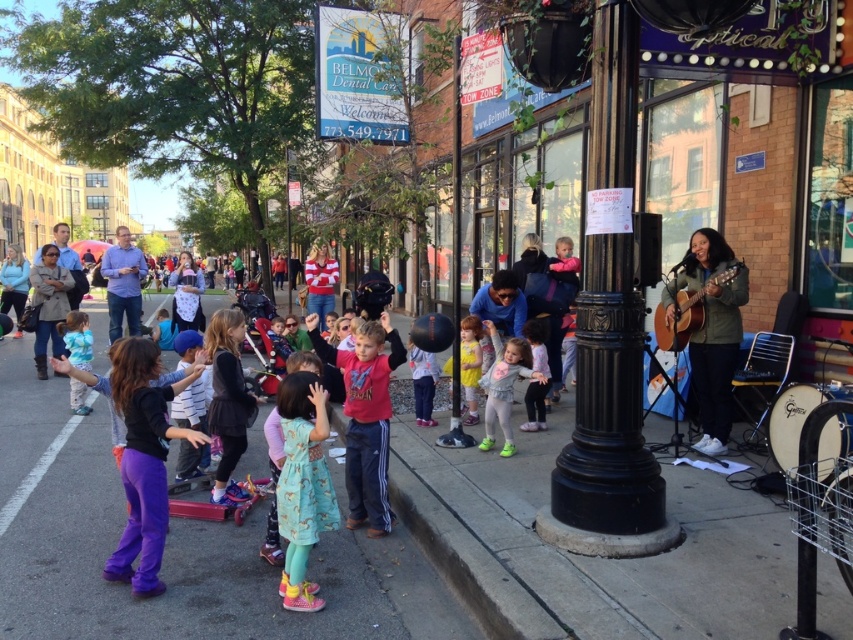
Who is more distant from viewer, (521,358) or (172,282)?

Positioned behind is point (172,282).

Who is higher up, pastel pink dress at center or matte black shirt at center?

matte black shirt at center

Is point (485, 372) farther from viewer compared to point (190, 305)?

That is False.

Locate an element on the screen. The height and width of the screenshot is (640, 853). pastel pink dress at center is located at coordinates (503, 385).

Between purple cotton pants at lower left and acoustic guitar at right, which one is positioned lower?

purple cotton pants at lower left

Between purple cotton pants at lower left and acoustic guitar at right, which one appears on the left side from the viewer's perspective?

Positioned to the left is purple cotton pants at lower left.

Locate an element on the screen. The image size is (853, 640). purple cotton pants at lower left is located at coordinates (144, 460).

Does green fabric jacket at right have a lesser height compared to pastel pink dress at center?

In fact, green fabric jacket at right may be taller than pastel pink dress at center.

Does point (711, 298) come closer to viewer compared to point (509, 356)?

That is True.

Identify the location of green fabric jacket at right. The image size is (853, 640). (711, 330).